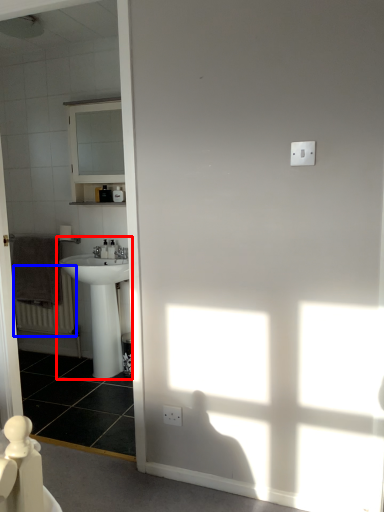
Question: Which of the following is the farthest to the observer, sink (highlighted by a red box) or radiator (highlighted by a blue box)?

Choices:
 (A) sink
 (B) radiator

Answer: (B)